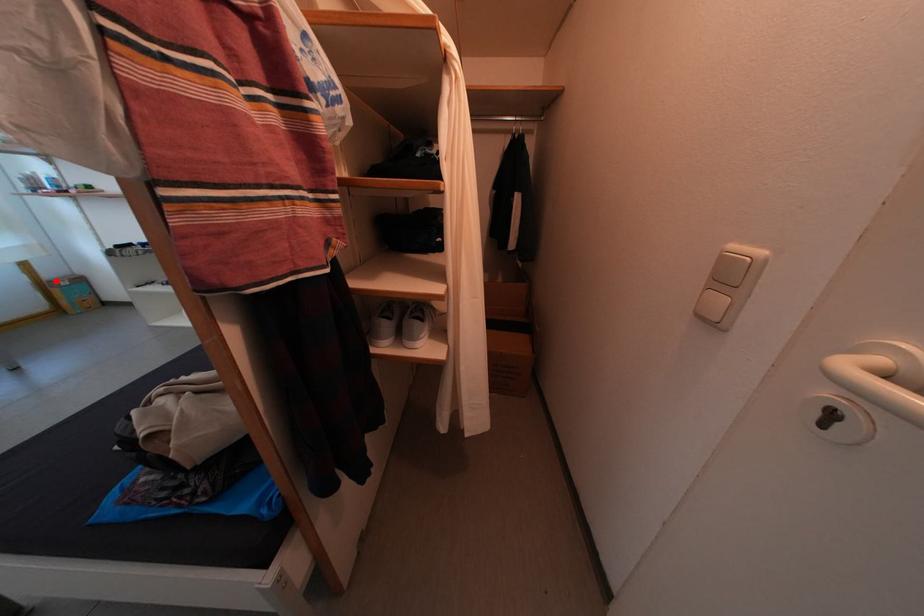
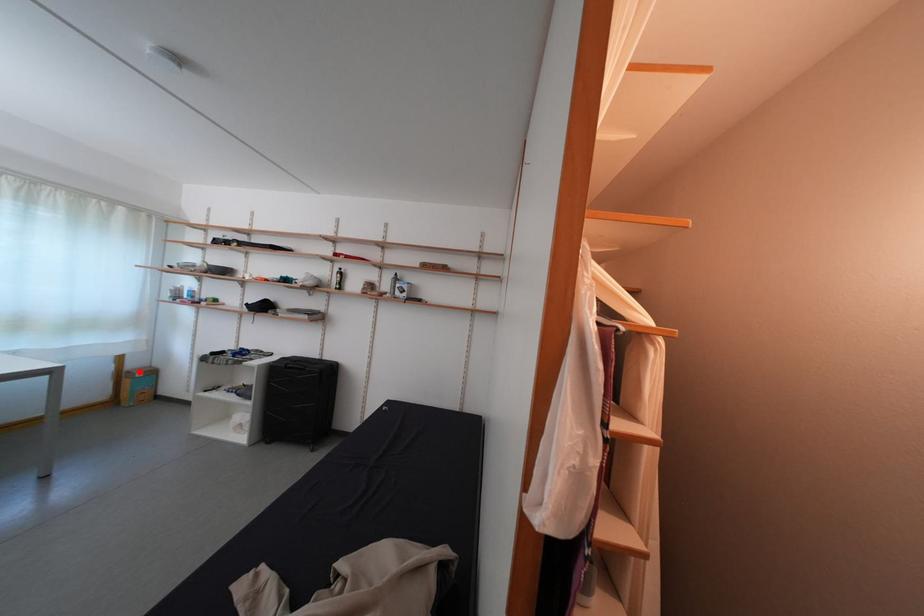
I am providing you with two images of the same scene from different viewpoints. A red point is marked on the first image and another point is marked on the second image. Is the marked point in image1 the same physical position as the marked point in image2?

Yes